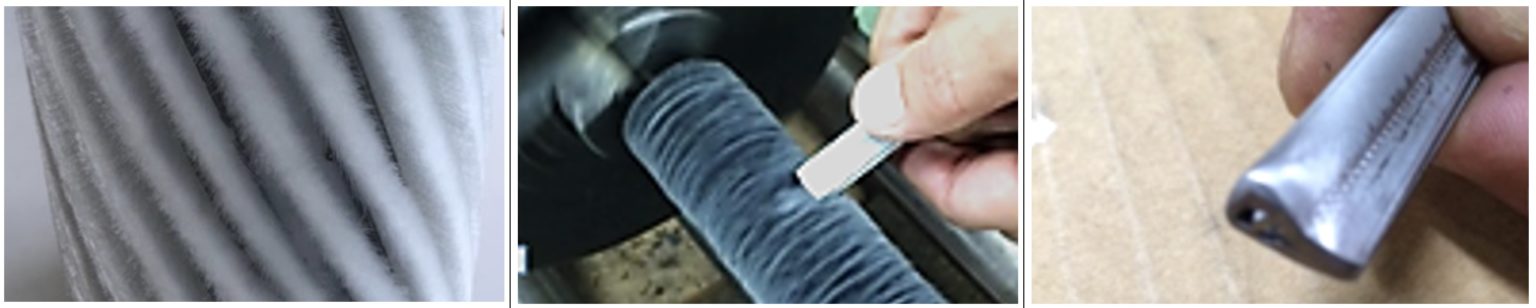
Image resolution: width=1536 pixels, height=308 pixels. Identify the location of table ridges. (1112, 148), (1181, 137), (1247, 96).